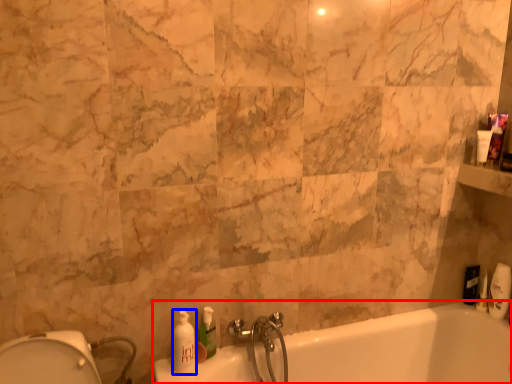
Question: Which object is further to the camera taking this photo, bathtub (highlighted by a red box) or soap dispenser (highlighted by a blue box)?

Choices:
 (A) bathtub
 (B) soap dispenser

Answer: (B)